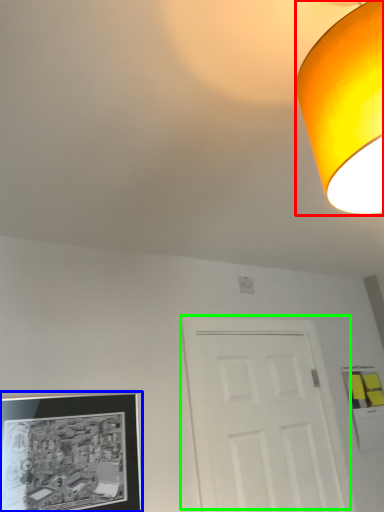
Question: Which object is positioned farthest from lamp (highlighted by a red box)? Select from picture frame (highlighted by a blue box) and door (highlighted by a green box).

Choices:
 (A) picture frame
 (B) door

Answer: (B)